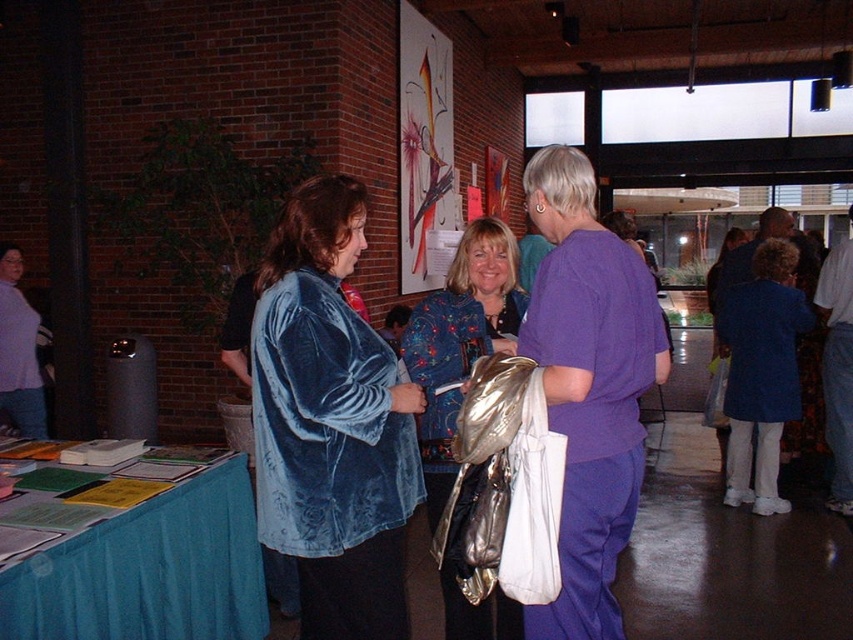
Question: Does velvet blue jacket at center appear on the left side of teal fabric table at lower left?

Choices:
 (A) no
 (B) yes

Answer: (A)

Question: Can you confirm if teal fabric table at lower left is smaller than floral-patterned fabric at center?

Choices:
 (A) no
 (B) yes

Answer: (B)

Question: Which of these objects is positioned farthest from the floral-patterned fabric at center?

Choices:
 (A) purple velvety scrubs at center
 (B) teal fabric table at lower left

Answer: (B)

Question: Which of the following is the farthest from the observer?

Choices:
 (A) (482, 236)
 (B) (206, 476)

Answer: (A)

Question: Based on their relative distances, which object is farther from the floral-patterned fabric at center?

Choices:
 (A) velvet blue jacket at center
 (B) teal fabric table at lower left
 (C) purple velvety scrubs at center

Answer: (B)

Question: Does purple velvety scrubs at center lie behind teal fabric table at lower left?

Choices:
 (A) no
 (B) yes

Answer: (B)